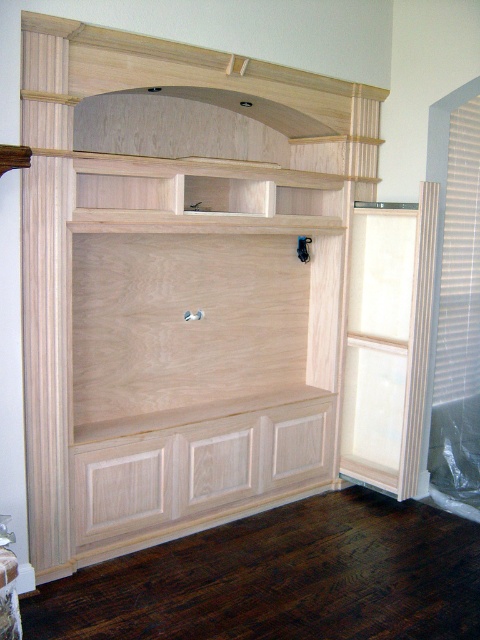
Measure the distance from natural wood bookshelf at center to natural wood drawer at lower center.

natural wood bookshelf at center is 19.88 inches from natural wood drawer at lower center.

Does natural wood bookshelf at center have a smaller size compared to natural wood drawer at lower center?

No.

Where is `natural wood bookshelf at center`? This screenshot has height=640, width=480. natural wood bookshelf at center is located at coordinates (179, 284).

Does natural wood bookshelf at center have a larger size compared to natural wood shelf at upper center?

Correct, natural wood bookshelf at center is larger in size than natural wood shelf at upper center.

The image size is (480, 640). In order to click on natural wood bookshelf at center in this screenshot , I will do `click(179, 284)`.

Does natural wood drawer at lower center appear on the left side of natural wood shelf at upper center?

In fact, natural wood drawer at lower center is to the right of natural wood shelf at upper center.

At what (x,y) coordinates should I click in order to perform the action: click on natural wood drawer at lower center. Please return your answer as a coordinate pair (x, y). This screenshot has width=480, height=640. Looking at the image, I should click on (197, 476).

Locate an element on the screen. natural wood drawer at lower center is located at coordinates (197, 476).